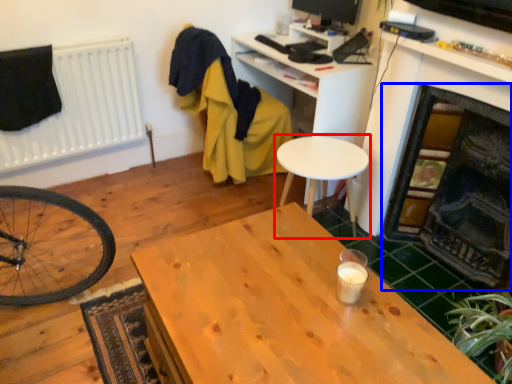
Question: Among these objects, which one is nearest to the camera, table (highlighted by a red box) or fireplace (highlighted by a blue box)?

Choices:
 (A) table
 (B) fireplace

Answer: (B)